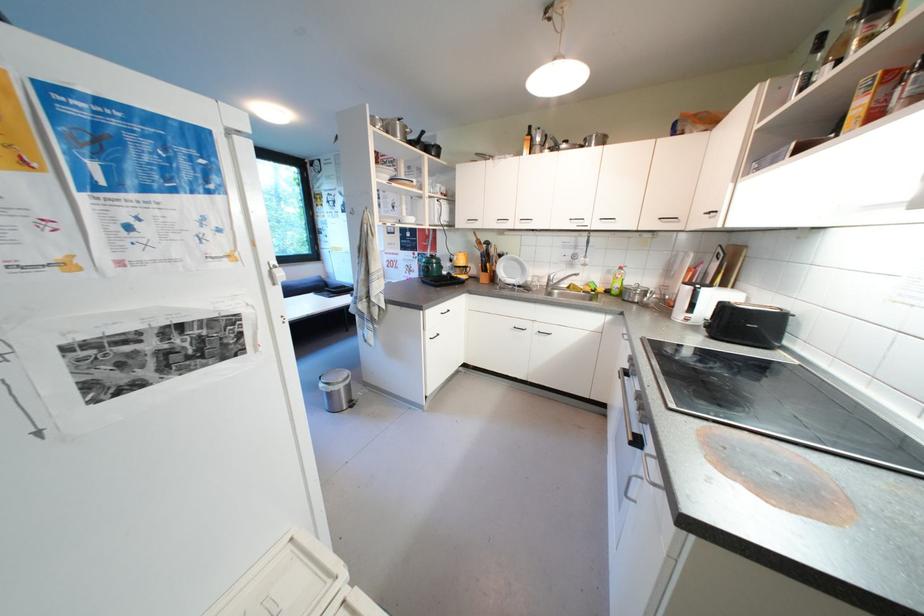
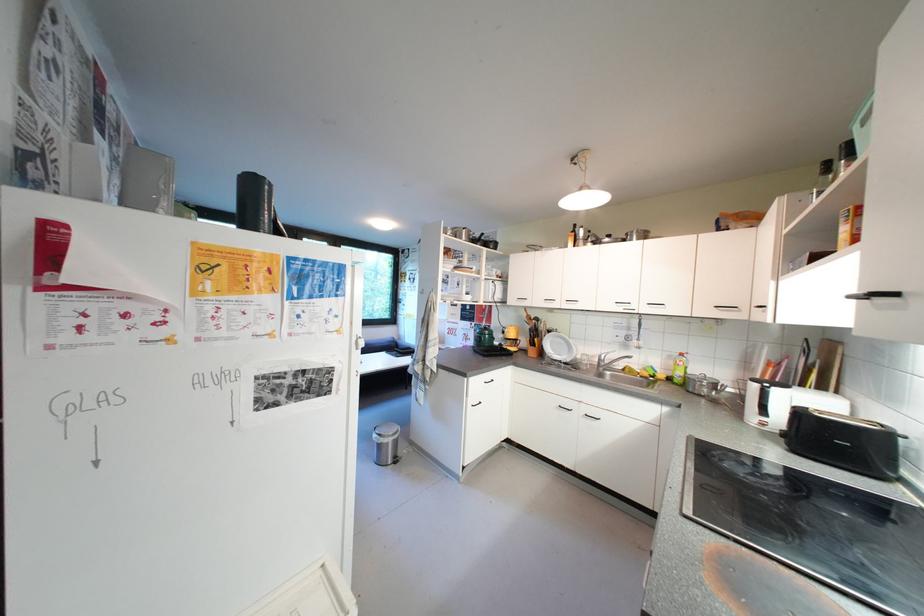
The point at [501,281] is marked in the first image. Where is the corresponding point in the second image?

(550, 355)